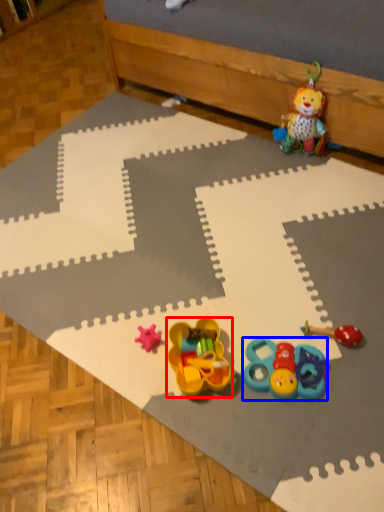
Question: Which object is further to the camera taking this photo, toy (highlighted by a red box) or toy (highlighted by a blue box)?

Choices:
 (A) toy
 (B) toy

Answer: (B)